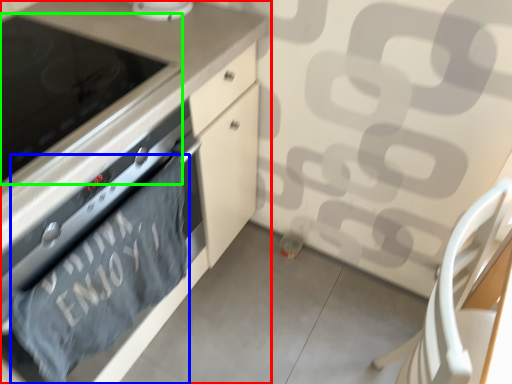
Question: Considering the real-world distances, which object is closest to cabinetry (highlighted by a red box)? bath towel (highlighted by a blue box) or home appliance (highlighted by a green box).

Choices:
 (A) bath towel
 (B) home appliance

Answer: (B)